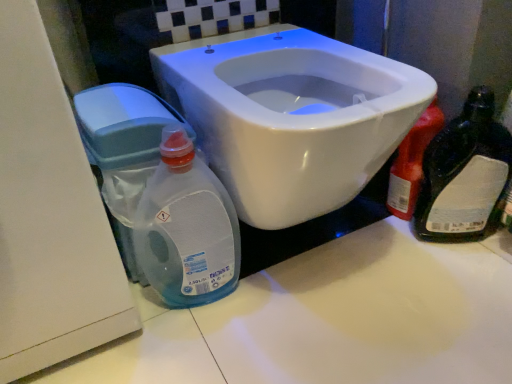
Locate an element on the screen. vacant space that is to the left of translucent plastic bottle at right is located at coordinates (374, 244).